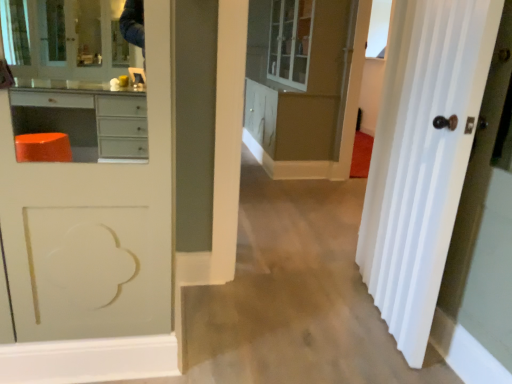
What do you see at coordinates (305, 86) in the screenshot?
I see `matte white cabinet at center` at bounding box center [305, 86].

At what (x,y) coordinates should I click in order to perform the action: click on matte white cabinet at center. Please return your answer as a coordinate pair (x, y). Looking at the image, I should click on (x=305, y=86).

Is matte white cabinet at center behind transparent glass window at upper right?

No, it is not.

Measure the distance between matte white cabinet at center and transparent glass window at upper right.

30.72 inches.

Which of these two, matte white cabinet at center or transparent glass window at upper right, stands shorter?

transparent glass window at upper right is shorter.

Is matte white cabinet at center located outside transparent glass window at upper right?

Yes, matte white cabinet at center is not within transparent glass window at upper right.

Does white glossy door at right appear on the left side of transparent glass window at upper right?

Yes.

Which is behind, white glossy door at right or transparent glass window at upper right?

transparent glass window at upper right is more distant.

Is white glossy door at right not within transparent glass window at upper right?

Yes.

From a real-world perspective, which is physically above, transparent glass window at upper right or matte white cabinet at center?

From a 3D spatial view, transparent glass window at upper right is above.

Which object is positioned more to the right, transparent glass window at upper right or matte white cabinet at center?

→ transparent glass window at upper right.

Relative to matte white cabinet at center, is transparent glass window at upper right in front or behind?

transparent glass window at upper right is behind matte white cabinet at center.

Is transparent glass window at upper right aimed at matte white cabinet at center?

Yes, transparent glass window at upper right is facing matte white cabinet at center.

Considering the sizes of objects matte white cabinet at center and white glossy door at right in the image provided, who is taller, matte white cabinet at center or white glossy door at right?

With more height is matte white cabinet at center.

Where is `door below the matte white cabinet at center (from a real-world perspective)`? The image size is (512, 384). door below the matte white cabinet at center (from a real-world perspective) is located at coordinates [x=422, y=157].

Between matte white cabinet at center and white glossy door at right, which one has smaller size?

white glossy door at right.

Is transparent glass window at upper right oriented towards white glossy door at right?

No, transparent glass window at upper right does not turn towards white glossy door at right.

Considering the positions of points (382, 18) and (433, 193), is point (382, 18) farther from camera compared to point (433, 193)?

Yes, point (382, 18) is farther from viewer.

Is transparent glass window at upper right next to white glossy door at right and touching it?

No, transparent glass window at upper right is not next to white glossy door at right.

Is white glossy door at right positioned in front of matte white cabinet at center?

Yes, the depth of white glossy door at right is less than that of matte white cabinet at center.

Is white glossy door at right not near matte white cabinet at center?

Yes, white glossy door at right is far from matte white cabinet at center.

From the picture: Can you tell me how much white glossy door at right and matte white cabinet at center differ in facing direction?

white glossy door at right and matte white cabinet at center are facing 9.44 degrees away from each other.

Locate an element on the screen. The image size is (512, 384). window behind the matte white cabinet at center is located at coordinates pyautogui.click(x=378, y=28).

I want to click on door located underneath the transparent glass window at upper right (from a real-world perspective), so click(422, 157).

When comparing their distances from white glossy door at right, does transparent glass window at upper right or matte white cabinet at center seem further?

The object further to white glossy door at right is transparent glass window at upper right.

Estimate the real-world distances between objects in this image. Which object is closer to white glossy door at right, matte white cabinet at center or transparent glass window at upper right?

The object closer to white glossy door at right is matte white cabinet at center.

Looking at the image, which one is located closer to transparent glass window at upper right, matte white cabinet at center or white glossy door at right?

matte white cabinet at center lies closer to transparent glass window at upper right than the other object.

Estimate the real-world distances between objects in this image. Which object is further from matte white cabinet at center, white glossy door at right or transparent glass window at upper right?

white glossy door at right is positioned further to the anchor matte white cabinet at center.

Looking at the image, which one is located further to transparent glass window at upper right, white glossy door at right or matte white cabinet at center?

Based on the image, white glossy door at right appears to be further to transparent glass window at upper right.

Estimate the real-world distances between objects in this image. Which object is closer to matte white cabinet at center, transparent glass window at upper right or white glossy door at right?

transparent glass window at upper right is closer to matte white cabinet at center.

At what (x,y) coordinates should I click in order to perform the action: click on cabinetry between white glossy door at right and transparent glass window at upper right from front to back. Please return your answer as a coordinate pair (x, y). Looking at the image, I should click on (305, 86).